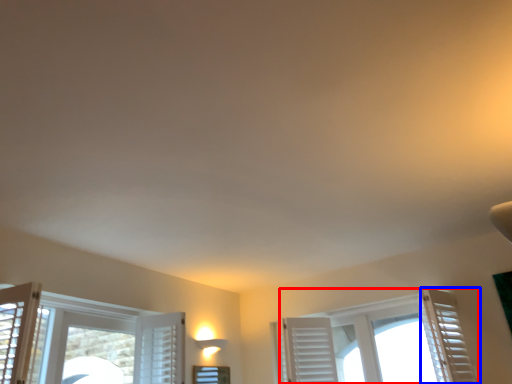
Question: Which point is further to the camera, window (highlighted by a red box) or curtain (highlighted by a blue box)?

Choices:
 (A) window
 (B) curtain

Answer: (A)